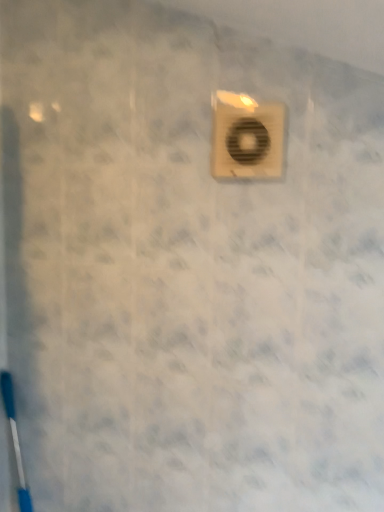
Image resolution: width=384 pixels, height=512 pixels. What are the coordinates of `white plastic light switch at center` in the screenshot? It's located at (247, 137).

What is the approximate height of white plastic light switch at center?

It is 6.43 inches.

The width and height of the screenshot is (384, 512). Describe the element at coordinates (247, 137) in the screenshot. I see `white plastic light switch at center` at that location.

What are the coordinates of `white plastic light switch at center` in the screenshot? It's located at (247, 137).